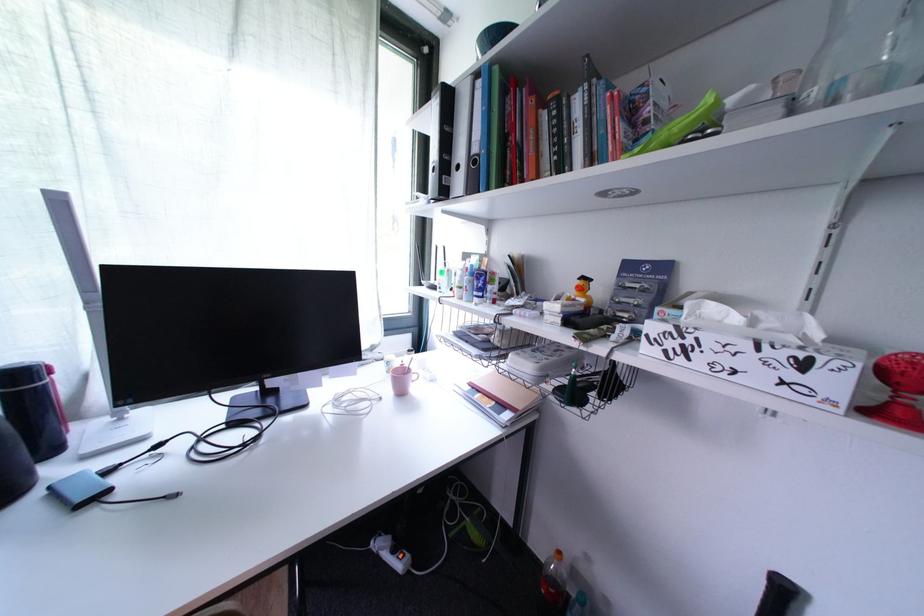
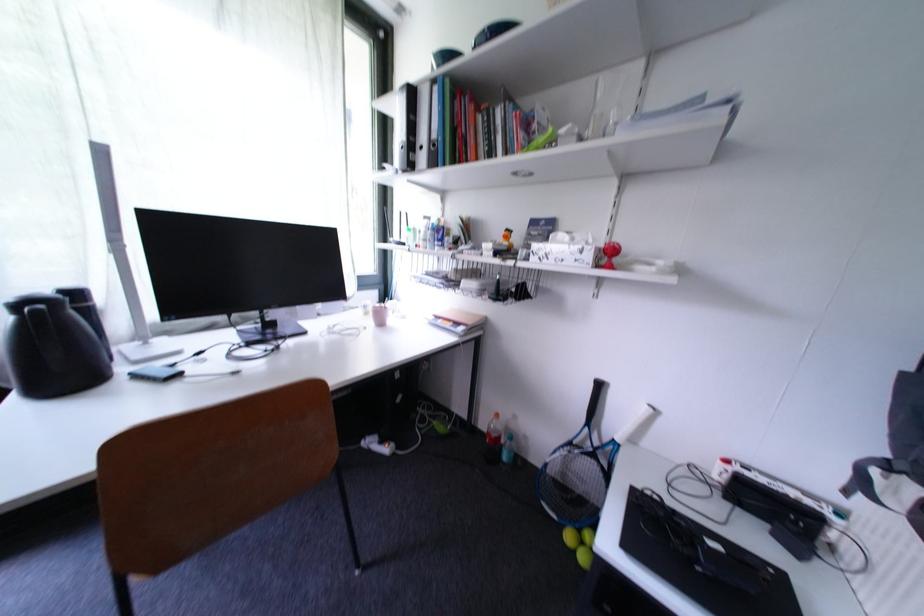
The point at (811,368) is marked in the first image. Where is the corresponding point in the second image?

(590, 253)